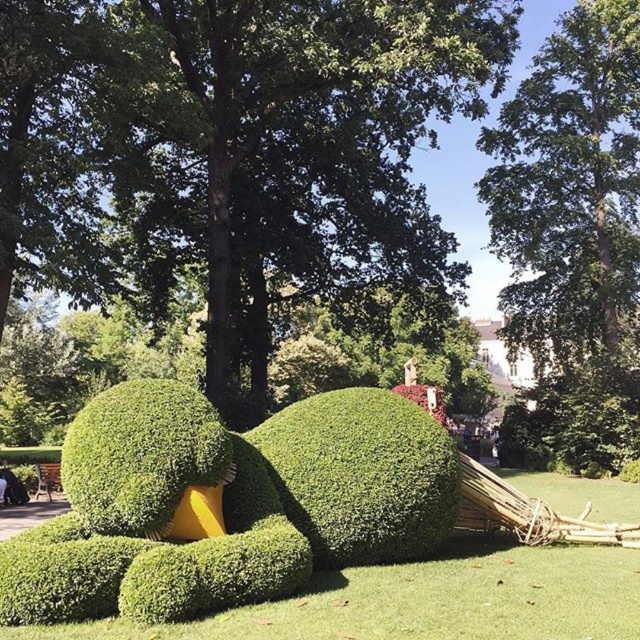
You are an artist planning to paint the scene. You want to ensure the green leafy tree at upper center and the green bushy hedge at center are proportionally accurate. Which object should you make larger in your painting?

The green leafy tree at upper center should be made larger in the painting because it is larger in size than the green bushy hedge at center according to the description.

You are a gardener observing the scene. You notice the green leafy tree at center and the green bushy hedge at center. Which one is located higher up in the image?

The green leafy tree at center is positioned over the green bushy hedge at center, so it is higher up in the image.

You are standing in the outdoor scene and want to locate the point at coordinates (x=570, y=182). Based on the scene description, where would this point be located?

The point at coordinates (x=570, y=182) is located on the green leafy tree at upper center.